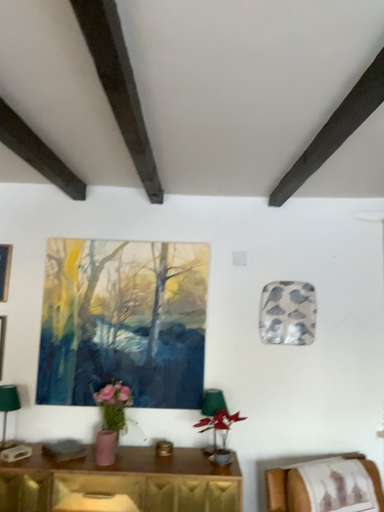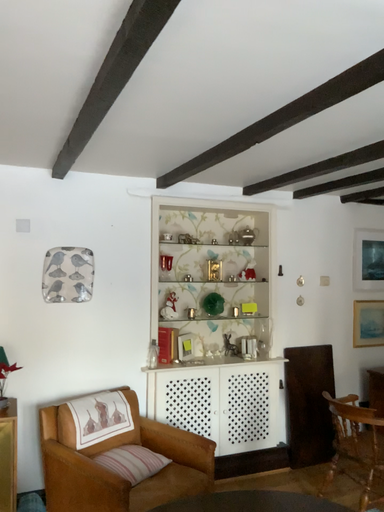
Question: How did the camera likely rotate when shooting the video?

Choices:
 (A) rotated right
 (B) rotated left

Answer: (A)